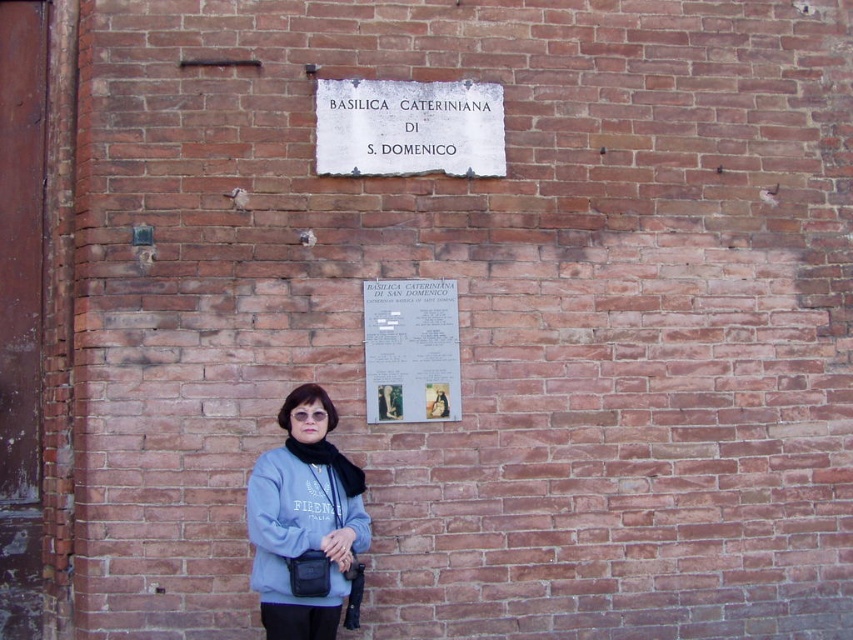
Is the position of light blue fleece at center more distant than that of white paper at upper center?

No, it is not.

Does point (282, 480) lie behind point (395, 384)?

No.

Where is `light blue fleece at center`? The width and height of the screenshot is (853, 640). light blue fleece at center is located at coordinates (305, 522).

Does light blue fleece at center have a greater height compared to white stone sign at upper center?

Yes.

In order to click on light blue fleece at center in this screenshot , I will do `click(305, 522)`.

Who is more forward, (273, 561) or (486, 125)?

Point (273, 561) is in front.

The image size is (853, 640). In order to click on light blue fleece at center in this screenshot , I will do `click(305, 522)`.

The width and height of the screenshot is (853, 640). What do you see at coordinates (408, 128) in the screenshot?
I see `white stone sign at upper center` at bounding box center [408, 128].

Find the location of a particular element. white stone sign at upper center is located at coordinates (408, 128).